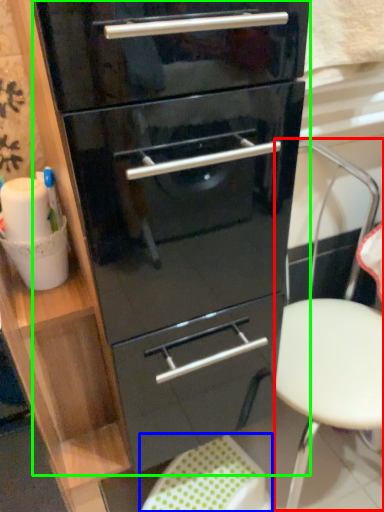
Question: Based on their relative distances, which object is farther from folding chair (highlighted by a red box)? Choose from step stool (highlighted by a blue box) and chest of drawers (highlighted by a green box).

Choices:
 (A) step stool
 (B) chest of drawers

Answer: (A)